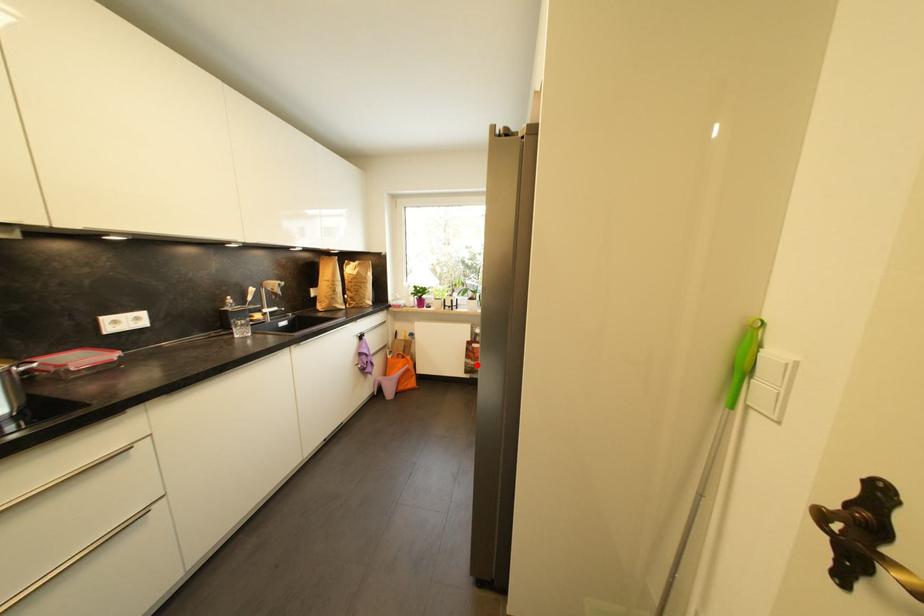
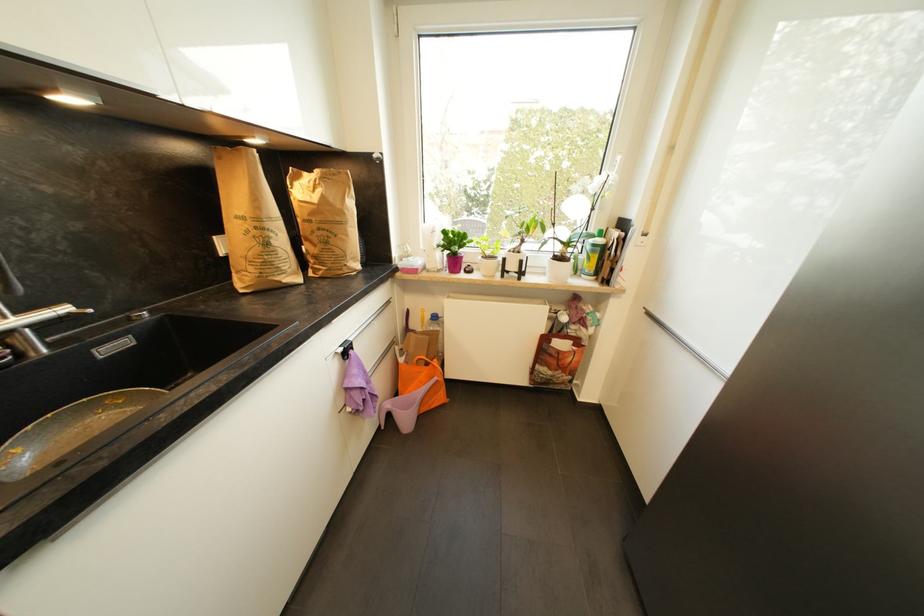
The point at the highlighted location is marked in the first image. Where is the corresponding point in the second image?

(554, 375)